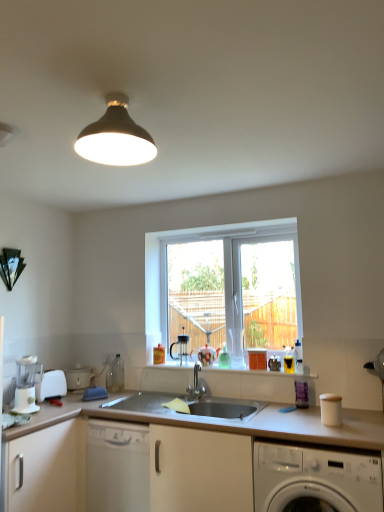
Question: From a real-world perspective, does translucent glass bottles at center sit lower than white matte countertop at center?

Choices:
 (A) yes
 (B) no

Answer: (B)

Question: Is translucent glass bottles at center next to white matte countertop at center?

Choices:
 (A) no
 (B) yes

Answer: (A)

Question: Is translucent glass bottles at center looking in the opposite direction of white matte countertop at center?

Choices:
 (A) yes
 (B) no

Answer: (B)

Question: Can you confirm if translucent glass bottles at center is shorter than white matte countertop at center?

Choices:
 (A) yes
 (B) no

Answer: (A)

Question: Does translucent glass bottles at center have a greater height compared to white matte countertop at center?

Choices:
 (A) yes
 (B) no

Answer: (B)

Question: Is translucent glass bottles at center thinner than white matte countertop at center?

Choices:
 (A) yes
 (B) no

Answer: (A)

Question: From the image's perspective, does white plastic food processor at lower left, which is the second appliance in back-to-front order, appear higher than white glossy washing machine at lower right?

Choices:
 (A) no
 (B) yes

Answer: (B)

Question: Is white glossy washing machine at lower right at the back of white plastic food processor at lower left, which is the second appliance in back-to-front order?

Choices:
 (A) no
 (B) yes

Answer: (A)

Question: Can you confirm if white plastic food processor at lower left, which is the second appliance in back-to-front order, is positioned to the right of white glossy washing machine at lower right?

Choices:
 (A) no
 (B) yes

Answer: (A)

Question: Does white plastic food processor at lower left, acting as the 1th appliance starting from the front, touch white glossy washing machine at lower right?

Choices:
 (A) no
 (B) yes

Answer: (A)

Question: Is white plastic food processor at lower left, acting as the 1th appliance starting from the front, not close to white glossy washing machine at lower right?

Choices:
 (A) no
 (B) yes

Answer: (B)

Question: Is white plastic food processor at lower left, which is the second appliance in back-to-front order, to the left of white glossy washing machine at lower right from the viewer's perspective?

Choices:
 (A) no
 (B) yes

Answer: (B)

Question: Can you confirm if white plastic food processor at lower left, which is the second appliance in back-to-front order, is positioned to the left of white matte countertop at center?

Choices:
 (A) no
 (B) yes

Answer: (B)